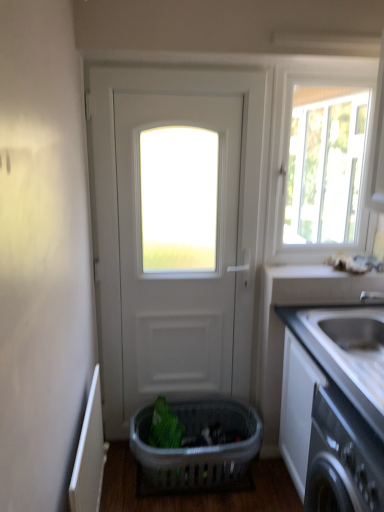
I want to click on empty space that is ontop of white matte door at center (from a real-world perspective), so click(x=175, y=71).